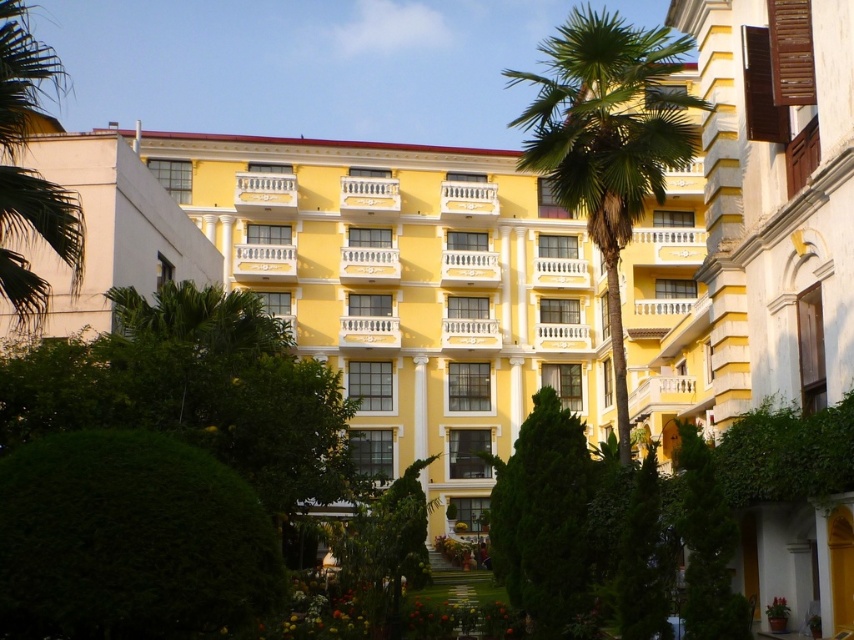
From the picture: You are a visitor approaching the entrance of the yellow painted building at center and notice the green leafy palm tree at center. Which object is closer to the entrance?

The yellow painted building at center is closer to the entrance than the green leafy palm tree at center because it is positioned under it.

You are standing at the entrance of the building and want to take a photo of the green textured tree at center. Where should you position yourself to capture it in the frame?

You should position yourself at the entrance and aim your camera towards the center of the garden where the green textured tree at center is located at point coordinates approximately (x=542, y=518).